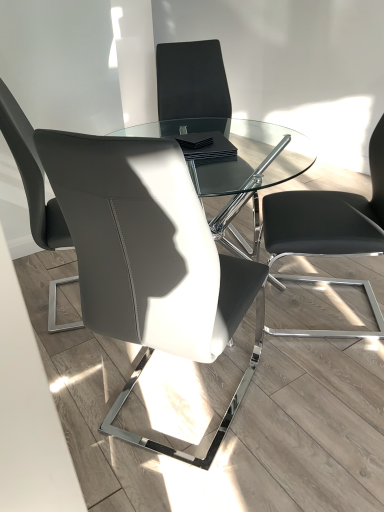
You are a GUI agent. You are given a task and a screenshot of the screen. Output one action in this format:
    pyautogui.click(x=<x>, y=<y>)
    Task: Click on the vacant space underneath matte black chair at center, which is the 3th chair from right to left (from a real-world perspective)
    This screenshot has width=384, height=512.
    Given the screenshot: What is the action you would take?
    pyautogui.click(x=178, y=411)